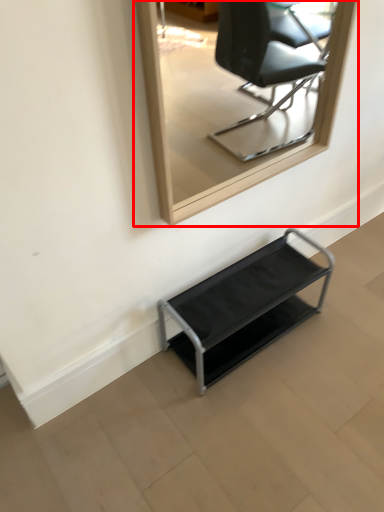
Question: From the image's perspective, what is the correct spatial positioning of mirror (annotated by the red box) in reference to furniture?

Choices:
 (A) below
 (B) above

Answer: (B)